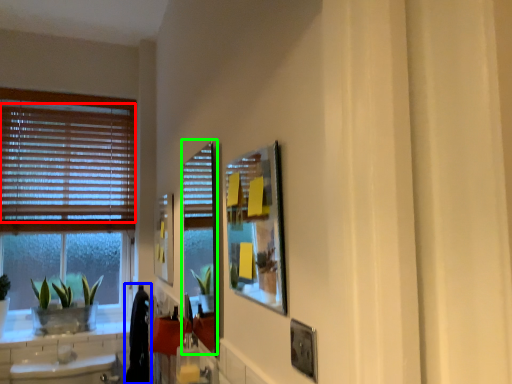
Question: Which object is positioned farthest from blind (highlighted by a red box)? Select from laundry (highlighted by a blue box) and screen door (highlighted by a green box).

Choices:
 (A) laundry
 (B) screen door

Answer: (A)